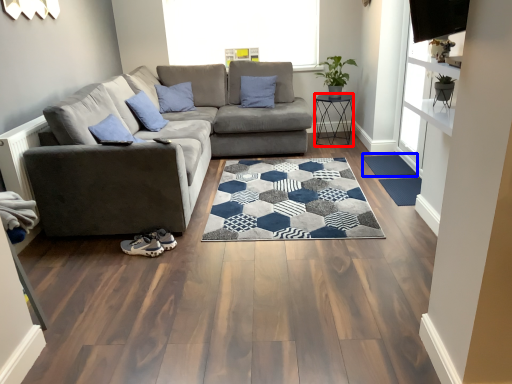
Question: Which of the following is the farthest to the observer, furniture (highlighted by a red box) or doormat (highlighted by a blue box)?

Choices:
 (A) furniture
 (B) doormat

Answer: (A)